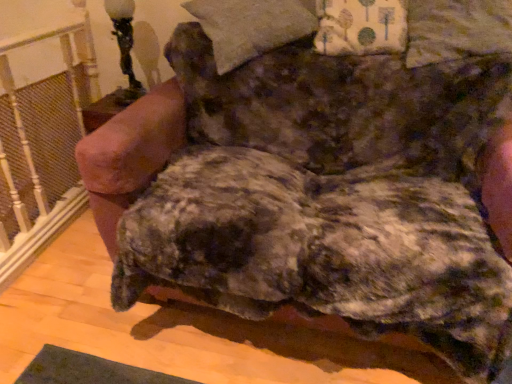
Question: Can you confirm if fluffy beige pillow at upper center, which is the 2th pillow from right to left, is taller than fluffy brown dog at center?

Choices:
 (A) yes
 (B) no

Answer: (B)

Question: Can you confirm if fluffy beige pillow at upper center, the first pillow from the left, is smaller than fluffy brown dog at center?

Choices:
 (A) no
 (B) yes

Answer: (B)

Question: Considering the relative positions of fluffy beige pillow at upper center, the first pillow from the left, and fluffy brown dog at center in the image provided, is fluffy beige pillow at upper center, the first pillow from the left, behind fluffy brown dog at center?

Choices:
 (A) yes
 (B) no

Answer: (A)

Question: Considering the relative positions of fluffy beige pillow at upper center, which is the 2th pillow from right to left, and fluffy brown dog at center in the image provided, is fluffy beige pillow at upper center, which is the 2th pillow from right to left, in front of fluffy brown dog at center?

Choices:
 (A) yes
 (B) no

Answer: (B)

Question: Can you confirm if fluffy beige pillow at upper center, which is the 2th pillow from right to left, is thinner than fluffy brown dog at center?

Choices:
 (A) no
 (B) yes

Answer: (B)

Question: From a real-world perspective, does fluffy beige pillow at upper center, which is the 2th pillow from right to left, sit lower than fluffy brown dog at center?

Choices:
 (A) yes
 (B) no

Answer: (B)

Question: Considering the relative sizes of floral fabric pillow at upper right, arranged as the 1th pillow when viewed from the right, and black glass table lamp at upper left in the image provided, is floral fabric pillow at upper right, arranged as the 1th pillow when viewed from the right, taller than black glass table lamp at upper left?

Choices:
 (A) no
 (B) yes

Answer: (A)

Question: Is the depth of floral fabric pillow at upper right, arranged as the 1th pillow when viewed from the right, greater than that of black glass table lamp at upper left?

Choices:
 (A) yes
 (B) no

Answer: (B)

Question: Is the depth of floral fabric pillow at upper right, arranged as the 1th pillow when viewed from the right, less than that of black glass table lamp at upper left?

Choices:
 (A) no
 (B) yes

Answer: (B)

Question: From the image's perspective, is floral fabric pillow at upper right, arranged as the 1th pillow when viewed from the right, over black glass table lamp at upper left?

Choices:
 (A) yes
 (B) no

Answer: (B)

Question: Is floral fabric pillow at upper right, the second pillow when ordered from left to right, touching black glass table lamp at upper left?

Choices:
 (A) no
 (B) yes

Answer: (A)

Question: From the image's perspective, would you say floral fabric pillow at upper right, the second pillow when ordered from left to right, is shown under black glass table lamp at upper left?

Choices:
 (A) yes
 (B) no

Answer: (A)

Question: Considering the relative sizes of floral fabric pillow at upper right, the second pillow when ordered from left to right, and fluffy beige pillow at upper center, the first pillow from the left, in the image provided, is floral fabric pillow at upper right, the second pillow when ordered from left to right, shorter than fluffy beige pillow at upper center, the first pillow from the left,?

Choices:
 (A) yes
 (B) no

Answer: (A)